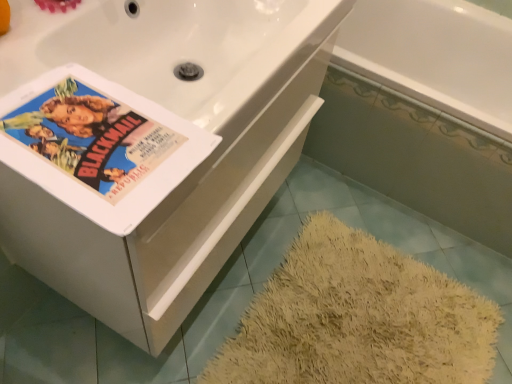
The height and width of the screenshot is (384, 512). What do you see at coordinates (435, 56) in the screenshot? I see `white glossy bathtub at upper right, which is counted as the second bath, starting from the front` at bounding box center [435, 56].

The height and width of the screenshot is (384, 512). Identify the location of white ceramic bathtub at upper right. (181, 116).

Identify the location of white glossy bathtub at lower right, the first bath in the front-to-back sequence. (424, 111).

You are a GUI agent. You are given a task and a screenshot of the screen. Output one action in this format:
    pyautogui.click(x=<x>, y=<y>)
    Task: Click on the matte paper poster at upper left
    This screenshot has height=384, width=512.
    Given the screenshot: What is the action you would take?
    pyautogui.click(x=98, y=145)

From a real-world perspective, who is located higher, white glossy bathtub at lower right, the first bath in the front-to-back sequence, or white ceramic bathtub at upper right?

white ceramic bathtub at upper right.

Is white glossy bathtub at lower right, the first bath in the front-to-back sequence, taller or shorter than white ceramic bathtub at upper right?

white glossy bathtub at lower right, the first bath in the front-to-back sequence, is shorter than white ceramic bathtub at upper right.

From a real-world perspective, which bath is the 2nd one underneath the white ceramic bathtub at upper right? Please provide its 2D coordinates.

[(424, 111)]

Between white glossy bathtub at lower right, arranged as the second bath when viewed from the back, and white ceramic bathtub at upper right, which one appears on the right side from the viewer's perspective?

white glossy bathtub at lower right, arranged as the second bath when viewed from the back.

Which of these two, white glossy bathtub at upper right, positioned as the 1th bath in back-to-front order, or white glossy bathtub at lower right, the first bath in the front-to-back sequence, is thinner?

With smaller width is white glossy bathtub at upper right, positioned as the 1th bath in back-to-front order.

Consider the image. From a real-world perspective, which object stands above the other?

white glossy bathtub at upper right, which is counted as the second bath, starting from the front.

Which of these two, white glossy bathtub at upper right, positioned as the 1th bath in back-to-front order, or white glossy bathtub at lower right, arranged as the second bath when viewed from the back, is bigger?

With larger size is white glossy bathtub at lower right, arranged as the second bath when viewed from the back.

Which object is closer to the camera taking this photo, white glossy bathtub at upper right, positioned as the 1th bath in back-to-front order, or white glossy bathtub at lower right, the first bath in the front-to-back sequence?

Positioned in front is white glossy bathtub at lower right, the first bath in the front-to-back sequence.

How far apart are white glossy bathtub at upper right, which is counted as the second bath, starting from the front, and matte paper poster at upper left?

A distance of 5.09 feet exists between white glossy bathtub at upper right, which is counted as the second bath, starting from the front, and matte paper poster at upper left.

Is white glossy bathtub at upper right, positioned as the 1th bath in back-to-front order, oriented towards matte paper poster at upper left?

No, white glossy bathtub at upper right, positioned as the 1th bath in back-to-front order, is not oriented towards matte paper poster at upper left.

Is white glossy bathtub at upper right, which is counted as the second bath, starting from the front, surrounding matte paper poster at upper left?

No, matte paper poster at upper left is not inside white glossy bathtub at upper right, which is counted as the second bath, starting from the front.

Find the location of `paperback book that is in front of the white glossy bathtub at upper right, which is counted as the second bath, starting from the front`. paperback book that is in front of the white glossy bathtub at upper right, which is counted as the second bath, starting from the front is located at coordinates (98, 145).

Is white ceramic bathtub at upper right to the right of white glossy bathtub at lower right, the first bath in the front-to-back sequence, from the viewer's perspective?

Incorrect, white ceramic bathtub at upper right is not on the right side of white glossy bathtub at lower right, the first bath in the front-to-back sequence.

Is white ceramic bathtub at upper right touching white glossy bathtub at lower right, the first bath in the front-to-back sequence?

No, white ceramic bathtub at upper right is not in contact with white glossy bathtub at lower right, the first bath in the front-to-back sequence.

In the scene shown: From a real-world perspective, is white ceramic bathtub at upper right positioned over white glossy bathtub at lower right, the first bath in the front-to-back sequence, based on gravity?

Yes.

Based on their sizes in the image, would you say white ceramic bathtub at upper right is bigger or smaller than white glossy bathtub at lower right, the first bath in the front-to-back sequence?

white ceramic bathtub at upper right is smaller than white glossy bathtub at lower right, the first bath in the front-to-back sequence.

Does white ceramic bathtub at upper right lie in front of matte paper poster at upper left?

No, white ceramic bathtub at upper right is further to the viewer.

Is white ceramic bathtub at upper right taller than matte paper poster at upper left?

Yes, white ceramic bathtub at upper right is taller than matte paper poster at upper left.

Is white ceramic bathtub at upper right smaller than matte paper poster at upper left?

Incorrect, white ceramic bathtub at upper right is not smaller in size than matte paper poster at upper left.

Which of these two, white ceramic bathtub at upper right or matte paper poster at upper left, is wider?

white ceramic bathtub at upper right is wider.

Considering the relative sizes of matte paper poster at upper left and white glossy bathtub at upper right, which is counted as the second bath, starting from the front, in the image provided, is matte paper poster at upper left shorter than white glossy bathtub at upper right, which is counted as the second bath, starting from the front,?

Correct, matte paper poster at upper left is not as tall as white glossy bathtub at upper right, which is counted as the second bath, starting from the front.

Is matte paper poster at upper left facing away from white glossy bathtub at upper right, which is counted as the second bath, starting from the front?

matte paper poster at upper left does not have its back to white glossy bathtub at upper right, which is counted as the second bath, starting from the front.

Consider the image. Is matte paper poster at upper left positioned far away from white glossy bathtub at upper right, which is counted as the second bath, starting from the front?

Indeed, matte paper poster at upper left is not near white glossy bathtub at upper right, which is counted as the second bath, starting from the front.

Could you measure the distance between white ceramic bathtub at upper right and white glossy bathtub at upper right, positioned as the 1th bath in back-to-front order?

They are 3.93 feet apart.

Consider the image. Considering the sizes of objects white ceramic bathtub at upper right and white glossy bathtub at upper right, which is counted as the second bath, starting from the front, in the image provided, who is wider, white ceramic bathtub at upper right or white glossy bathtub at upper right, which is counted as the second bath, starting from the front,?

white ceramic bathtub at upper right.

Does white ceramic bathtub at upper right have a greater height compared to white glossy bathtub at upper right, positioned as the 1th bath in back-to-front order?

Correct, white ceramic bathtub at upper right is much taller as white glossy bathtub at upper right, positioned as the 1th bath in back-to-front order.

From a real-world perspective, is white ceramic bathtub at upper right beneath white glossy bathtub at upper right, which is counted as the second bath, starting from the front?

Actually, white ceramic bathtub at upper right is physically above white glossy bathtub at upper right, which is counted as the second bath, starting from the front, in the real world.

The image size is (512, 384). In order to click on the 2nd bath positioned below the white ceramic bathtub at upper right (from a real-world perspective) in this screenshot , I will do `click(424, 111)`.

You are a GUI agent. You are given a task and a screenshot of the screen. Output one action in this format:
    pyautogui.click(x=<x>, y=<y>)
    Task: Click on the bath in front of the white glossy bathtub at upper right, positioned as the 1th bath in back-to-front order
    The image size is (512, 384).
    Given the screenshot: What is the action you would take?
    pyautogui.click(x=424, y=111)

From the image, which object appears to be farther from matte paper poster at upper left, white glossy bathtub at upper right, which is counted as the second bath, starting from the front, or white ceramic bathtub at upper right?

white glossy bathtub at upper right, which is counted as the second bath, starting from the front, lies further to matte paper poster at upper left than the other object.

Looking at the image, which one is located closer to matte paper poster at upper left, white glossy bathtub at lower right, the first bath in the front-to-back sequence, or white glossy bathtub at upper right, positioned as the 1th bath in back-to-front order?

Among the two, white glossy bathtub at lower right, the first bath in the front-to-back sequence, is located nearer to matte paper poster at upper left.

Looking at the image, which one is located closer to white glossy bathtub at lower right, the first bath in the front-to-back sequence, white ceramic bathtub at upper right or white glossy bathtub at upper right, which is counted as the second bath, starting from the front?

Based on the image, white glossy bathtub at upper right, which is counted as the second bath, starting from the front, appears to be nearer to white glossy bathtub at lower right, the first bath in the front-to-back sequence.

Looking at the image, which one is located further to white glossy bathtub at upper right, positioned as the 1th bath in back-to-front order, white ceramic bathtub at upper right or white glossy bathtub at lower right, the first bath in the front-to-back sequence?

white ceramic bathtub at upper right lies further to white glossy bathtub at upper right, positioned as the 1th bath in back-to-front order, than the other object.

When comparing their distances from white glossy bathtub at lower right, arranged as the second bath when viewed from the back, does matte paper poster at upper left or white ceramic bathtub at upper right seem closer?

white ceramic bathtub at upper right is positioned closer to the anchor white glossy bathtub at lower right, arranged as the second bath when viewed from the back.

Considering their positions, is white ceramic bathtub at upper right positioned further to white glossy bathtub at lower right, arranged as the second bath when viewed from the back, than matte paper poster at upper left?

matte paper poster at upper left.

Which object lies further to the anchor point white glossy bathtub at upper right, which is counted as the second bath, starting from the front, white ceramic bathtub at upper right or matte paper poster at upper left?

The object further to white glossy bathtub at upper right, which is counted as the second bath, starting from the front, is matte paper poster at upper left.

Looking at the image, which one is located closer to matte paper poster at upper left, white glossy bathtub at lower right, the first bath in the front-to-back sequence, or white ceramic bathtub at upper right?

white ceramic bathtub at upper right.

The width and height of the screenshot is (512, 384). Find the location of `bathtub between matte paper poster at upper left and white glossy bathtub at lower right, the first bath in the front-to-back sequence, from left to right`. bathtub between matte paper poster at upper left and white glossy bathtub at lower right, the first bath in the front-to-back sequence, from left to right is located at coordinates (181, 116).

Locate an element on the screen. Image resolution: width=512 pixels, height=384 pixels. bathtub located between matte paper poster at upper left and white glossy bathtub at upper right, positioned as the 1th bath in back-to-front order, in the depth direction is located at coordinates (181, 116).

Find the location of a particular element. The height and width of the screenshot is (384, 512). bath between white ceramic bathtub at upper right and white glossy bathtub at lower right, arranged as the second bath when viewed from the back is located at coordinates (435, 56).

In order to click on bath between matte paper poster at upper left and white glossy bathtub at lower right, arranged as the second bath when viewed from the back in this screenshot , I will do `click(435, 56)`.